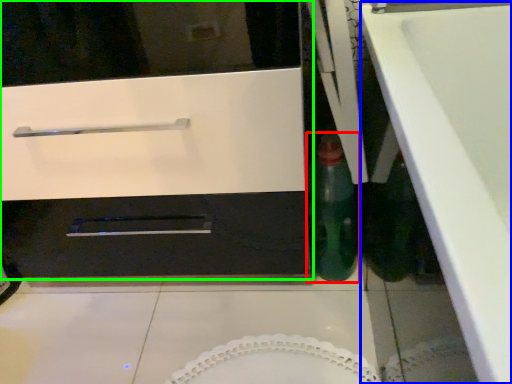
Question: Estimate the real-world distances between objects in this image. Which object is farther from bottle (highlighted by a red box), counter top (highlighted by a blue box) or oven (highlighted by a green box)?

Choices:
 (A) counter top
 (B) oven

Answer: (A)